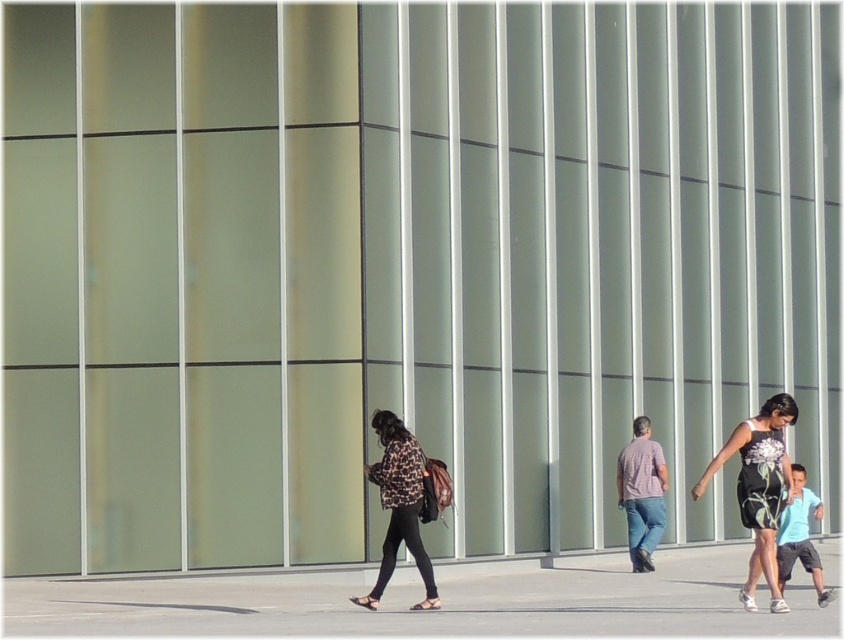
Between gray concrete pavement at center and leopard print jacket at center, which one is positioned lower?

gray concrete pavement at center is lower down.

Which is behind, point (322, 602) or point (398, 419)?

Positioned behind is point (322, 602).

Locate an element on the screen. gray concrete pavement at center is located at coordinates (428, 612).

Consider the image. Can you confirm if black floral dress at right is shorter than light blue t-shirt at center-right?

No.

Can you confirm if black floral dress at right is positioned above light blue t-shirt at center-right?

Indeed, black floral dress at right is positioned over light blue t-shirt at center-right.

Between point (777, 424) and point (786, 563), which one is positioned behind?

The point (786, 563) is behind.

Where is `black floral dress at right`? Image resolution: width=844 pixels, height=640 pixels. black floral dress at right is located at coordinates (759, 488).

Which is more to the left, leopard print jacket at center or light blue t-shirt at center-right?

leopard print jacket at center is more to the left.

Is point (385, 472) positioned before point (825, 593)?

That is False.

Is point (410, 468) positioned after point (807, 508)?

That is False.

I want to click on leopard print jacket at center, so click(x=399, y=506).